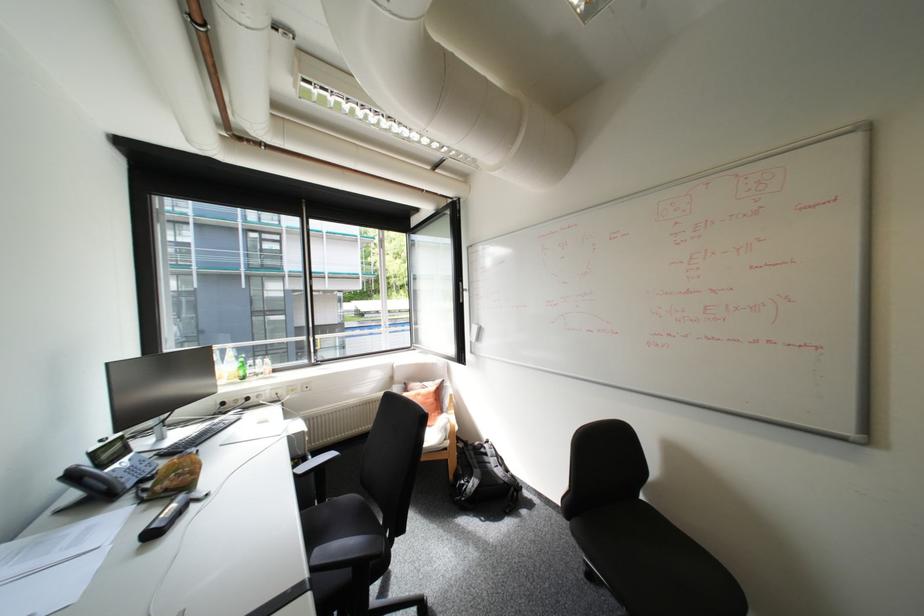
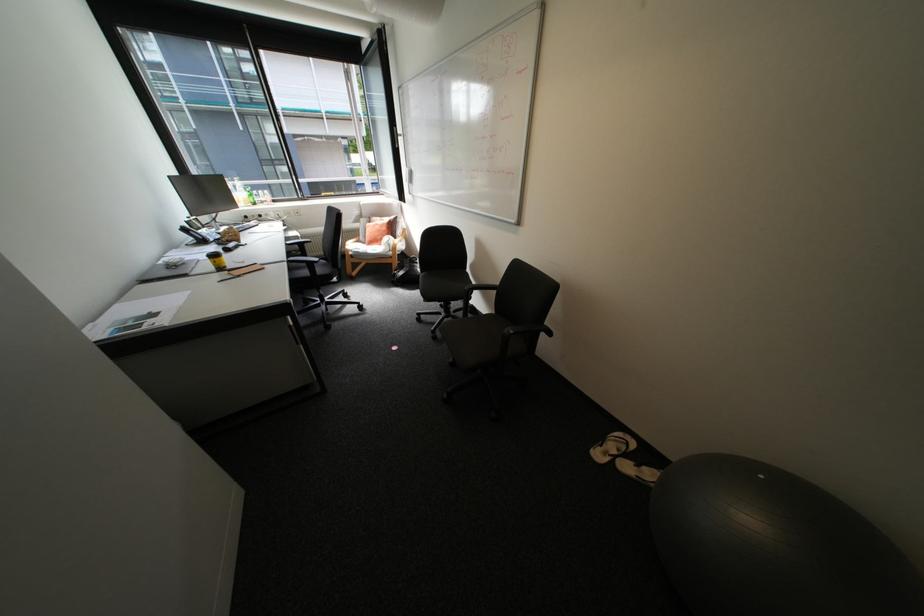
Locate, in the second image, the point that corresponds to point 315,573 in the first image.

(295, 259)